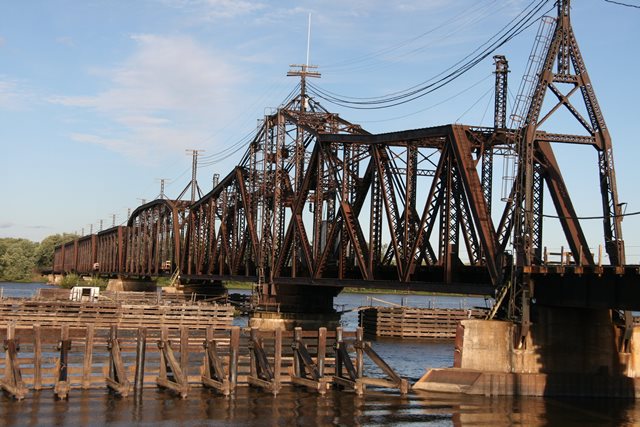
At what (x,y) coordinates should I click in order to perform the action: click on cable. Please return your answer as a coordinate pair (x, y). Looking at the image, I should click on (461, 63).